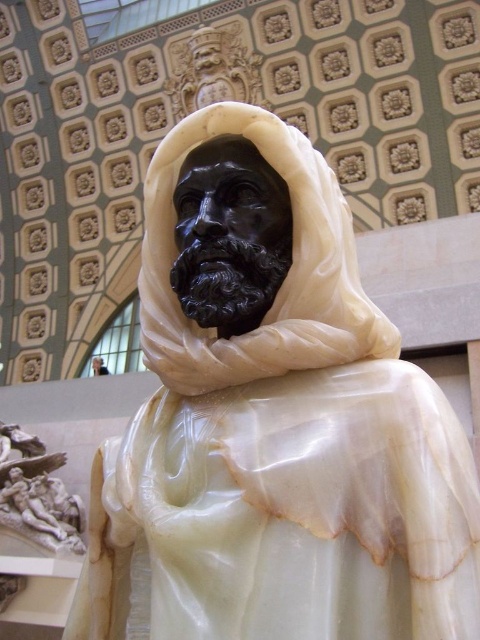
Is black marble statue at center shorter than white marble relief at lower left?

No.

Is black marble statue at center to the left of white marble relief at lower left from the viewer's perspective?

No, black marble statue at center is not to the left of white marble relief at lower left.

Between point (339, 548) and point (58, 525), which one is positioned in front?

Point (339, 548) is more forward.

Find the location of a particular element. The width and height of the screenshot is (480, 640). black marble statue at center is located at coordinates (275, 419).